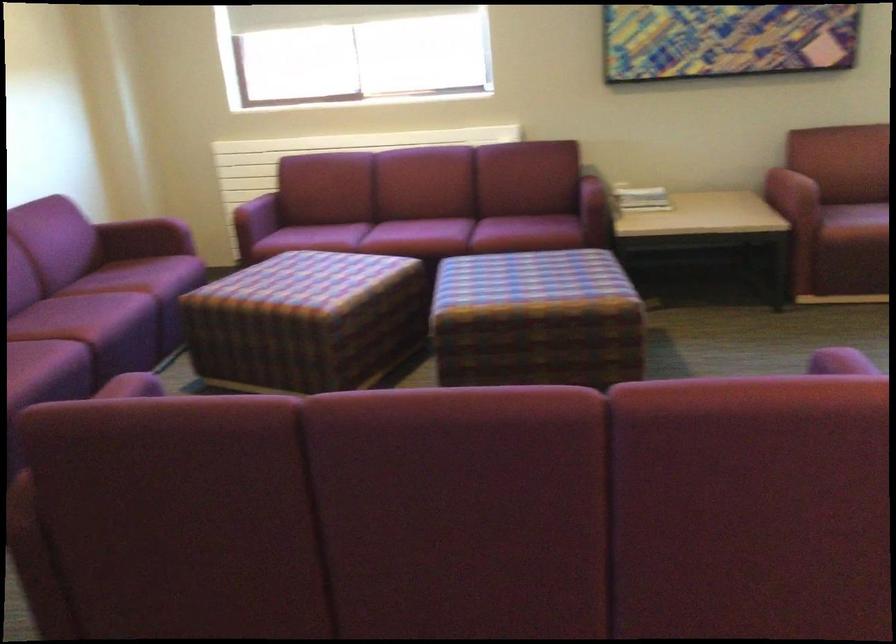
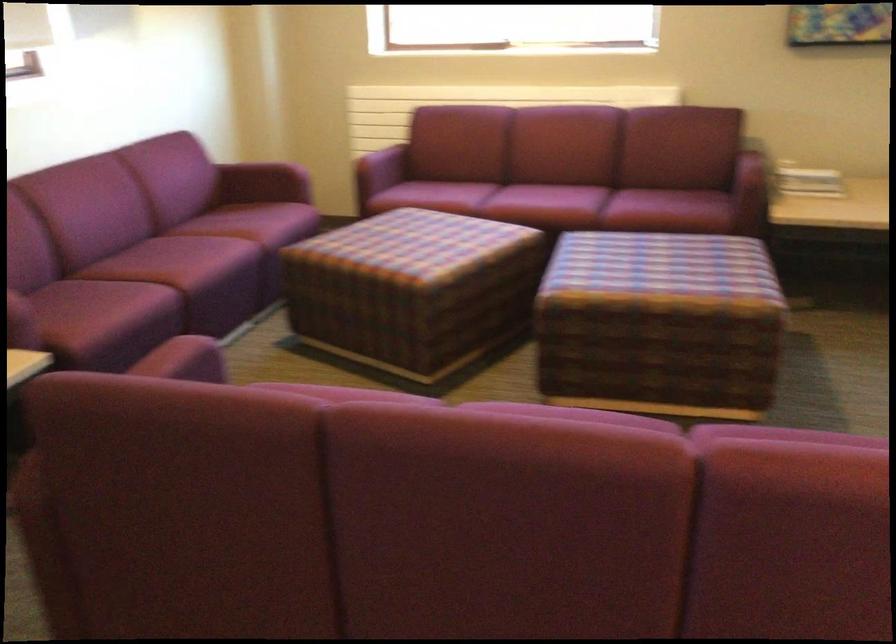
Locate, in the second image, the point that corresponds to (152,228) in the first image.

(269, 173)